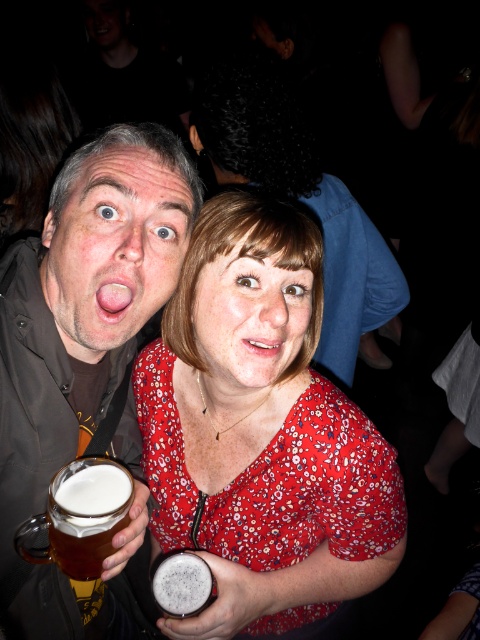
Question: Considering the relative positions of translucent glass mug at left and translucent glass mug at lower left in the image provided, where is translucent glass mug at left located with respect to translucent glass mug at lower left?

Choices:
 (A) right
 (B) left

Answer: (B)

Question: Can you confirm if translucent glass mug at left is positioned above translucent glass mug at lower left?

Choices:
 (A) yes
 (B) no

Answer: (A)

Question: Which point is farther from the camera taking this photo?

Choices:
 (A) (82, 321)
 (B) (51, 522)

Answer: (A)

Question: Which point appears closest to the camera in this image?

Choices:
 (A) (261, 356)
 (B) (68, 474)
 (C) (398, 515)

Answer: (A)

Question: Which of the following is the farthest from the observer?

Choices:
 (A) translucent glass mug at left
 (B) matte floral dress at center
 (C) foamy white beer at center
 (D) red floral blouse at center

Answer: (C)

Question: Is matte floral dress at center in front of translucent glass mug at left?

Choices:
 (A) no
 (B) yes

Answer: (A)